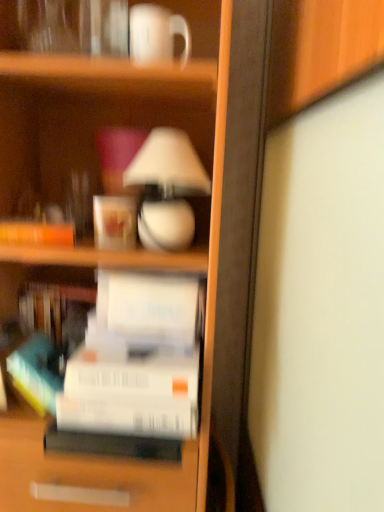
Question: From the image's perspective, is matte white coffee cup at upper center, the 2th coffee cup in the front-to-back sequence, located beneath white glossy lamp at upper center?

Choices:
 (A) yes
 (B) no

Answer: (A)

Question: From a real-world perspective, is matte white coffee cup at upper center, which is the first coffee cup from left to right, physically above white glossy lamp at upper center?

Choices:
 (A) yes
 (B) no

Answer: (B)

Question: Considering the relative sizes of matte white coffee cup at upper center, the 2th coffee cup in the front-to-back sequence, and white glossy lamp at upper center in the image provided, is matte white coffee cup at upper center, the 2th coffee cup in the front-to-back sequence, wider than white glossy lamp at upper center?

Choices:
 (A) no
 (B) yes

Answer: (A)

Question: Considering the relative sizes of matte white coffee cup at upper center, which appears as the 1th coffee cup when ordered from the bottom, and white glossy lamp at upper center in the image provided, is matte white coffee cup at upper center, which appears as the 1th coffee cup when ordered from the bottom, shorter than white glossy lamp at upper center?

Choices:
 (A) yes
 (B) no

Answer: (A)

Question: From a real-world perspective, is matte white coffee cup at upper center, which is the first coffee cup from left to right, positioned under white glossy lamp at upper center based on gravity?

Choices:
 (A) no
 (B) yes

Answer: (B)

Question: Is the surface of matte white coffee cup at upper center, the 2th coffee cup when ordered from top to bottom, in direct contact with white glossy lamp at upper center?

Choices:
 (A) yes
 (B) no

Answer: (B)

Question: Is white glossy lamp at upper center at the right side of white glossy mug at upper center, marked as the second coffee cup in a bottom-to-top arrangement?

Choices:
 (A) yes
 (B) no

Answer: (A)

Question: Considering the relative sizes of white glossy lamp at upper center and white glossy mug at upper center, which appears as the first coffee cup when viewed from the right, in the image provided, is white glossy lamp at upper center taller than white glossy mug at upper center, which appears as the first coffee cup when viewed from the right,?

Choices:
 (A) no
 (B) yes

Answer: (B)

Question: Is white glossy lamp at upper center smaller than white glossy mug at upper center, which is the 2th coffee cup in left-to-right order?

Choices:
 (A) no
 (B) yes

Answer: (A)

Question: Is white glossy mug at upper center, which is the second coffee cup from back to front, at the back of white glossy lamp at upper center?

Choices:
 (A) no
 (B) yes

Answer: (A)

Question: Are white glossy lamp at upper center and white glossy mug at upper center, which is the second coffee cup from back to front, beside each other?

Choices:
 (A) yes
 (B) no

Answer: (B)

Question: Is white glossy lamp at upper center aimed at white glossy mug at upper center, the first coffee cup viewed from the front?

Choices:
 (A) no
 (B) yes

Answer: (A)

Question: Would you say white matte paper at center, which appears as the first paperback book when viewed from the top, contains matte white coffee cup at upper center, the 2th coffee cup when ordered from top to bottom?

Choices:
 (A) yes
 (B) no

Answer: (B)